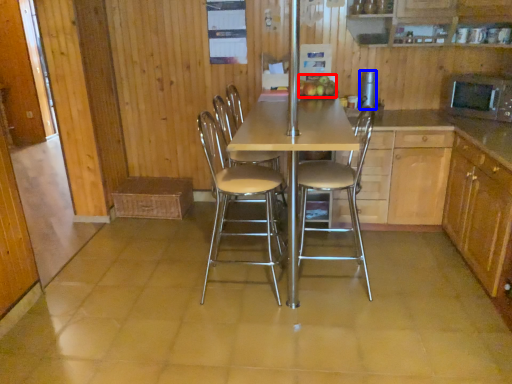
Question: Which of the following is the closest to the observer, fruit (highlighted by a red box) or appliance (highlighted by a blue box)?

Choices:
 (A) fruit
 (B) appliance

Answer: (A)